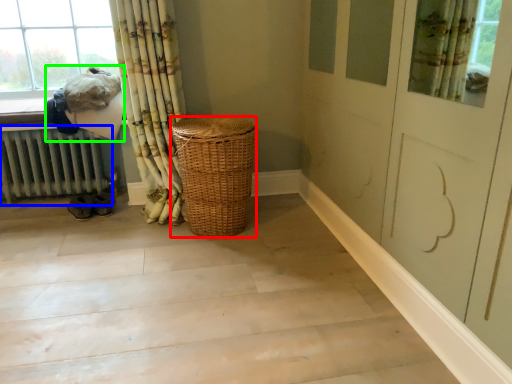
Question: Based on their relative distances, which object is nearer to basket (highlighted by a red box)? Choose from radiator (highlighted by a blue box) and laundry (highlighted by a green box).

Choices:
 (A) radiator
 (B) laundry

Answer: (B)